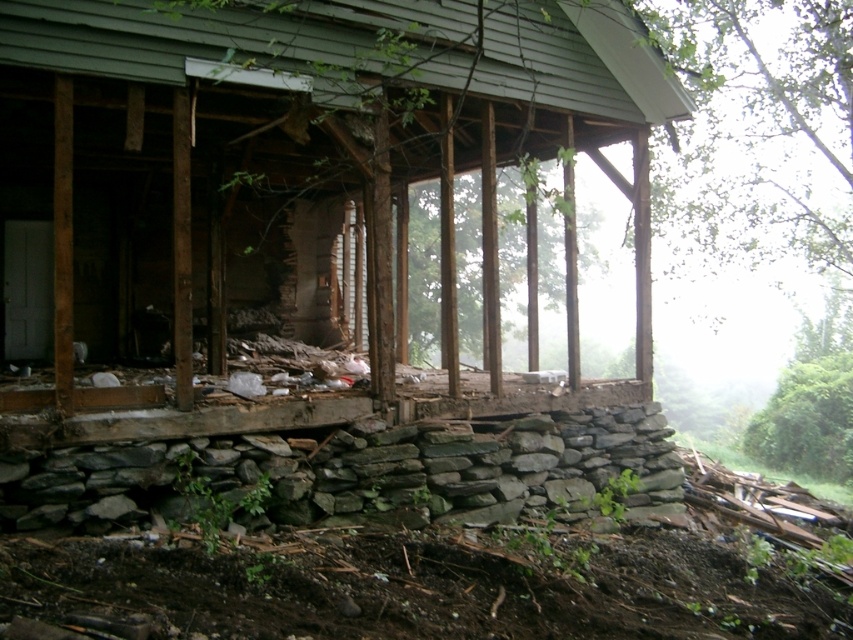
Question: Is weathered wood porch at center below rusty wood porch at center?

Choices:
 (A) yes
 (B) no

Answer: (B)

Question: Is the position of gray rough stone wall at lower center less distant than that of rusty wood porch at center?

Choices:
 (A) no
 (B) yes

Answer: (A)

Question: Considering the real-world distances, which object is closest to the weathered wood porch at center?

Choices:
 (A) gray rough stone wall at lower center
 (B) rusty wood porch at center

Answer: (B)

Question: Among these objects, which one is farthest from the camera?

Choices:
 (A) rusty wood porch at center
 (B) gray rough stone wall at lower center
 (C) weathered wood porch at center

Answer: (B)

Question: Which of the following is the closest to the observer?

Choices:
 (A) (146, 116)
 (B) (320, 397)

Answer: (B)

Question: Where is weathered wood porch at center located in relation to rusty wood porch at center in the image?

Choices:
 (A) below
 (B) above

Answer: (B)